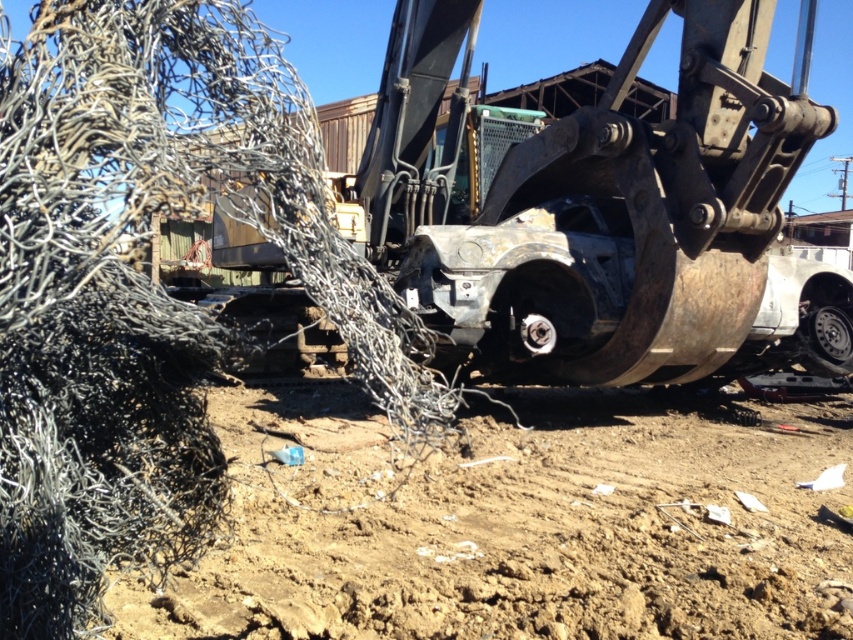
You are a worker at the demolition site. You need to move a 3.5 meter long metal beam from the brown soil at lower center to the black rubber tire at lower right. Can you place the entire beam on the ground between them without it overlapping anything else?

The distance between the brown soil at lower center and the black rubber tire at lower right is 4.08 meters. Since the beam is 3.5 meters long, it can be placed between them without overlapping as there is enough space.

You are a construction worker who needs to place a heavy tool on the ground. You have two options for placement areas in the scene described. The brown soil at lower center and the black rubber tire at lower right. Which area would be more stable for placing the tool, and why?

The brown soil at lower center is more stable because it is wider than the black rubber tire at lower right, providing a larger and steadier base for the tool.

Based on the photo, you are a worker at the demolition site. You need to place a heavy object on the brown soil at lower center without it rolling away. Is the black rubber tire at lower right in a position that could interfere with this task?

The brown soil at lower center is to the left of the black rubber tire at lower right. Since the tire is positioned to the right of the soil, placing the heavy object on the soil should not be directly interfered by the tire unless it rolls towards the tire. However, the tire is located at the lower right, so as long as the object is placed stably on the soil, the tire should not obstruct the placement.